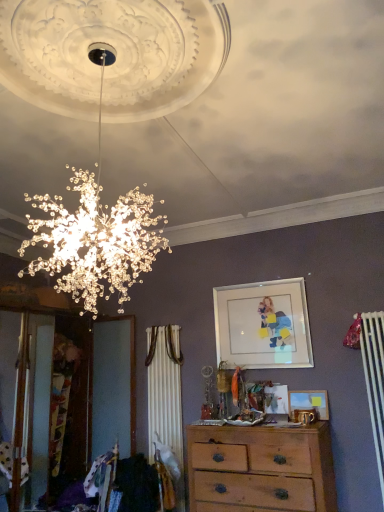
Locate an element on the screen. The image size is (384, 512). matte glass picture frame at upper center, which is the first picture frame from top to bottom is located at coordinates (263, 325).

Which object is positioned more to the left, matte glass picture frame at upper center, which is the second picture frame from bottom to top, or wooden chest of drawers at center?

wooden chest of drawers at center.

The height and width of the screenshot is (512, 384). Find the location of `the 2nd picture frame behind the wooden chest of drawers at center`. the 2nd picture frame behind the wooden chest of drawers at center is located at coordinates (263, 325).

From their relative heights in the image, would you say matte glass picture frame at upper center, which is the second picture frame from bottom to top, is taller or shorter than wooden chest of drawers at center?

Clearly, matte glass picture frame at upper center, which is the second picture frame from bottom to top, is taller compared to wooden chest of drawers at center.

Is matte glass picture frame at upper center, which is the first picture frame from top to bottom, looking in the opposite direction of wooden chest of drawers at center?

That's not correct — matte glass picture frame at upper center, which is the first picture frame from top to bottom, is not looking away from wooden chest of drawers at center.

How different are the orientations of matte glass picture frame at upper center, which is the second picture frame from bottom to top, and matte wooden picture frame at center, acting as the 2th picture frame starting from the top, in degrees?

There is a 0.00272-degree angle between the facing directions of matte glass picture frame at upper center, which is the second picture frame from bottom to top, and matte wooden picture frame at center, acting as the 2th picture frame starting from the top.

I want to click on picture frame below the matte glass picture frame at upper center, which is the first picture frame from top to bottom (from the image's perspective), so click(309, 402).

Could you tell me if matte glass picture frame at upper center, which is the second picture frame from bottom to top, is facing matte wooden picture frame at center, acting as the 2th picture frame starting from the top?

No, matte glass picture frame at upper center, which is the second picture frame from bottom to top, is not facing towards matte wooden picture frame at center, acting as the 2th picture frame starting from the top.

Which is behind, matte glass picture frame at upper center, which is the first picture frame from top to bottom, or matte wooden picture frame at center, placed as the first picture frame when sorted from bottom to top?

A: matte glass picture frame at upper center, which is the first picture frame from top to bottom, is behind.

Is matte glass picture frame at upper center, which is the second picture frame from bottom to top, inside matte wooden picture frame at center, acting as the 2th picture frame starting from the top?

No, matte glass picture frame at upper center, which is the second picture frame from bottom to top, is not surrounded by matte wooden picture frame at center, acting as the 2th picture frame starting from the top.

Would you say matte wooden picture frame at center, acting as the 2th picture frame starting from the top, is a long distance from matte glass picture frame at upper center, which is the second picture frame from bottom to top?

No, matte wooden picture frame at center, acting as the 2th picture frame starting from the top, is not far away from matte glass picture frame at upper center, which is the second picture frame from bottom to top.

Could you tell me if matte wooden picture frame at center, placed as the first picture frame when sorted from bottom to top, is turned towards matte glass picture frame at upper center, which is the first picture frame from top to bottom?

No, matte wooden picture frame at center, placed as the first picture frame when sorted from bottom to top, does not turn towards matte glass picture frame at upper center, which is the first picture frame from top to bottom.

The height and width of the screenshot is (512, 384). I want to click on the 2nd picture frame counting from the right of the wooden chest of drawers at center, so click(x=309, y=402).

Does wooden chest of drawers at center appear on the left side of matte wooden picture frame at center, placed as the first picture frame when sorted from bottom to top?

Yes.

From a real-world perspective, relative to matte wooden picture frame at center, placed as the first picture frame when sorted from bottom to top, is wooden chest of drawers at center vertically above or below?

From a real-world perspective, wooden chest of drawers at center is physically below matte wooden picture frame at center, placed as the first picture frame when sorted from bottom to top.

Is wooden chest of drawers at center not inside matte wooden picture frame at center, placed as the first picture frame when sorted from bottom to top?

That's correct, wooden chest of drawers at center is outside of matte wooden picture frame at center, placed as the first picture frame when sorted from bottom to top.

Considering the sizes of objects wooden chest of drawers at center and matte glass picture frame at upper center, which is the second picture frame from bottom to top, in the image provided, who is bigger, wooden chest of drawers at center or matte glass picture frame at upper center, which is the second picture frame from bottom to top,?

wooden chest of drawers at center is bigger.

Is wooden chest of drawers at center turned away from matte glass picture frame at upper center, which is the second picture frame from bottom to top?

No, wooden chest of drawers at center is not facing away from matte glass picture frame at upper center, which is the second picture frame from bottom to top.

Is matte wooden picture frame at center, acting as the 2th picture frame starting from the top, in front of wooden chest of drawers at center?

No, it is behind wooden chest of drawers at center.

From the image's perspective, is matte wooden picture frame at center, acting as the 2th picture frame starting from the top, located above or below wooden chest of drawers at center?

From the image's perspective, matte wooden picture frame at center, acting as the 2th picture frame starting from the top, appears above wooden chest of drawers at center.

Is matte wooden picture frame at center, placed as the first picture frame when sorted from bottom to top, oriented away from wooden chest of drawers at center?

No, wooden chest of drawers at center is not at the back of matte wooden picture frame at center, placed as the first picture frame when sorted from bottom to top.

I want to click on chest of drawers located on the left of matte glass picture frame at upper center, which is the second picture frame from bottom to top, so click(260, 468).

Image resolution: width=384 pixels, height=512 pixels. In order to click on picture frame below the matte glass picture frame at upper center, which is the first picture frame from top to bottom (from the image's perspective) in this screenshot , I will do coord(309,402).

Based on their spatial positions, is matte wooden picture frame at center, placed as the first picture frame when sorted from bottom to top, or matte glass picture frame at upper center, which is the first picture frame from top to bottom, closer to wooden chest of drawers at center?

matte wooden picture frame at center, placed as the first picture frame when sorted from bottom to top, is positioned closer to the anchor wooden chest of drawers at center.

Based on their spatial positions, is matte glass picture frame at upper center, which is the first picture frame from top to bottom, or matte wooden picture frame at center, placed as the first picture frame when sorted from bottom to top, closer to wooden chest of drawers at center?

matte wooden picture frame at center, placed as the first picture frame when sorted from bottom to top, lies closer to wooden chest of drawers at center than the other object.

Looking at the image, which one is located closer to matte glass picture frame at upper center, which is the first picture frame from top to bottom, matte wooden picture frame at center, placed as the first picture frame when sorted from bottom to top, or wooden chest of drawers at center?

matte wooden picture frame at center, placed as the first picture frame when sorted from bottom to top.

Considering their positions, is wooden chest of drawers at center positioned further to matte wooden picture frame at center, acting as the 2th picture frame starting from the top, than matte glass picture frame at upper center, which is the second picture frame from bottom to top?

Among the two, wooden chest of drawers at center is located further to matte wooden picture frame at center, acting as the 2th picture frame starting from the top.

Considering their positions, is matte glass picture frame at upper center, which is the second picture frame from bottom to top, positioned closer to matte wooden picture frame at center, acting as the 2th picture frame starting from the top, than wooden chest of drawers at center?

The object closer to matte wooden picture frame at center, acting as the 2th picture frame starting from the top, is matte glass picture frame at upper center, which is the second picture frame from bottom to top.

Looking at the image, which one is located further to matte glass picture frame at upper center, which is the first picture frame from top to bottom, wooden chest of drawers at center or matte wooden picture frame at center, acting as the 2th picture frame starting from the top?

wooden chest of drawers at center.

You are a GUI agent. You are given a task and a screenshot of the screen. Output one action in this format:
    pyautogui.click(x=<x>, y=<y>)
    Task: Click on the picture frame between matte glass picture frame at upper center, which is the first picture frame from top to bottom, and wooden chest of drawers at center vertically
    This screenshot has width=384, height=512.
    Given the screenshot: What is the action you would take?
    pyautogui.click(x=309, y=402)